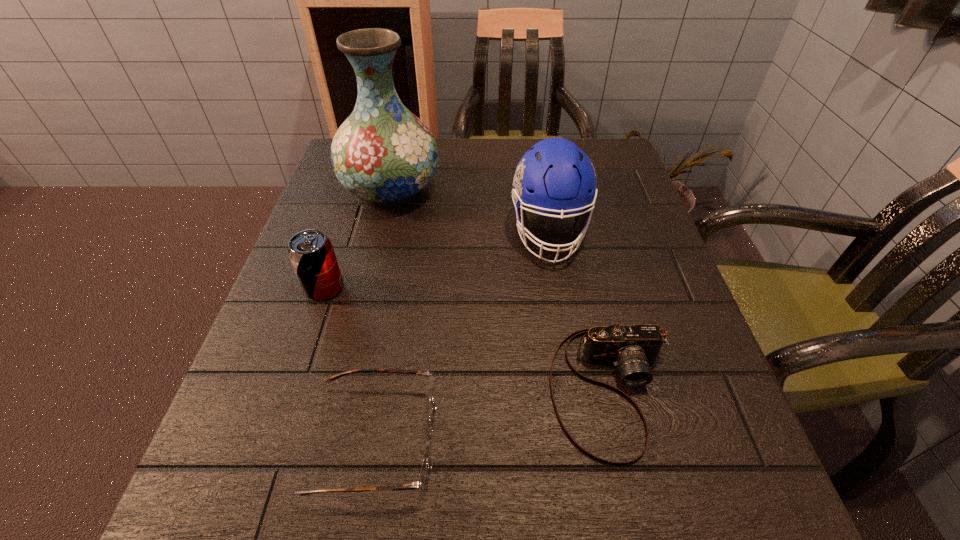
The width and height of the screenshot is (960, 540). What are the coordinates of `vacant space located 0.230m on the front-facing side of the spectacles` in the screenshot? It's located at click(595, 440).

I want to click on object that is positioned at the far edge, so click(383, 153).

Find the location of a particular element. object present at the near edge is located at coordinates (426, 470).

Locate an element on the screen. This screenshot has width=960, height=540. vase that is positioned at the left edge is located at coordinates (383, 153).

The image size is (960, 540). In order to click on soda can present at the left edge in this screenshot , I will do `click(311, 253)`.

Where is `spectacles that is at the left edge`? Image resolution: width=960 pixels, height=540 pixels. spectacles that is at the left edge is located at coordinates (426, 470).

Image resolution: width=960 pixels, height=540 pixels. Find the location of `football helmet that is positioned at the right edge`. football helmet that is positioned at the right edge is located at coordinates (554, 176).

You are a GUI agent. You are given a task and a screenshot of the screen. Output one action in this format:
    pyautogui.click(x=<x>, y=<y>)
    Task: Click on the camera that is at the right edge
    
    Given the screenshot: What is the action you would take?
    pyautogui.click(x=632, y=348)

This screenshot has width=960, height=540. In order to click on object at the far left corner in this screenshot , I will do `click(383, 153)`.

This screenshot has width=960, height=540. Find the location of `object positioned at the near left corner`. object positioned at the near left corner is located at coordinates (426, 470).